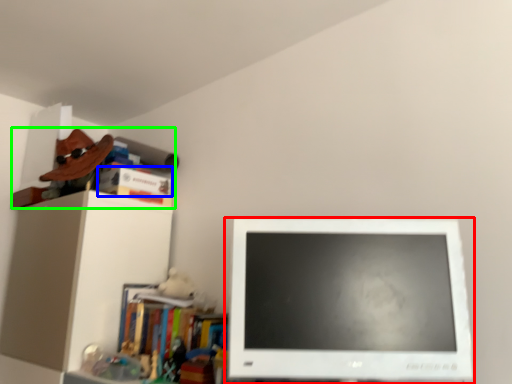
Question: Which object is the farthest from computer monitor (highlighted by a red box)? Choose among these: book (highlighted by a blue box) or book (highlighted by a green box).

Choices:
 (A) book
 (B) book

Answer: (A)